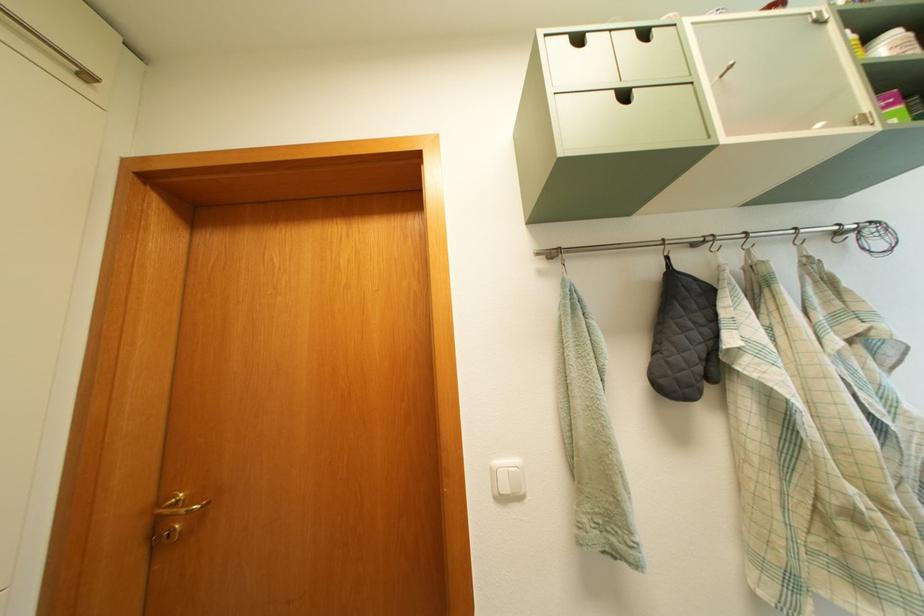
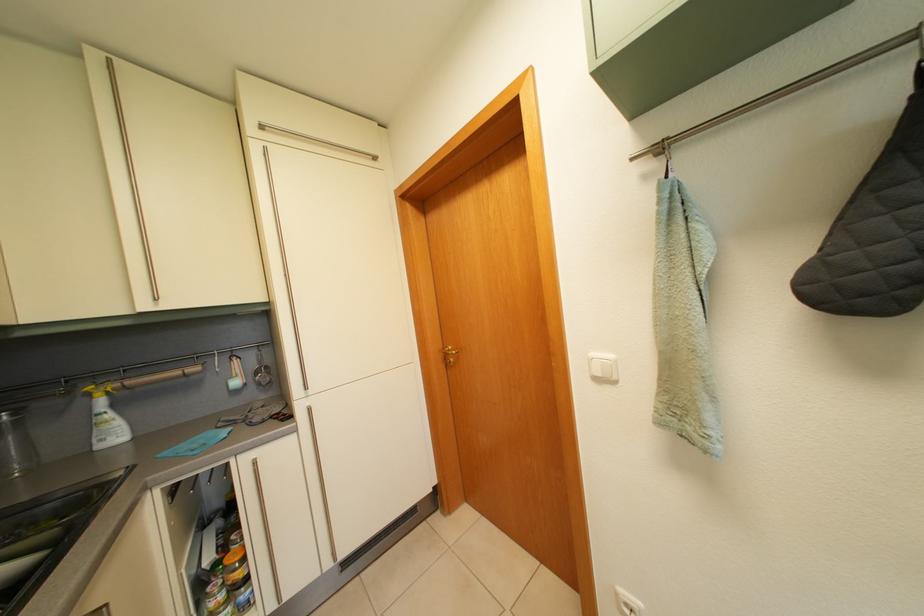
Question: The images are taken continuously from a first-person perspective. In which direction is your viewpoint rotating?

Choices:
 (A) Left
 (B) Right
 (C) Up
 (D) Down

Answer: (A)